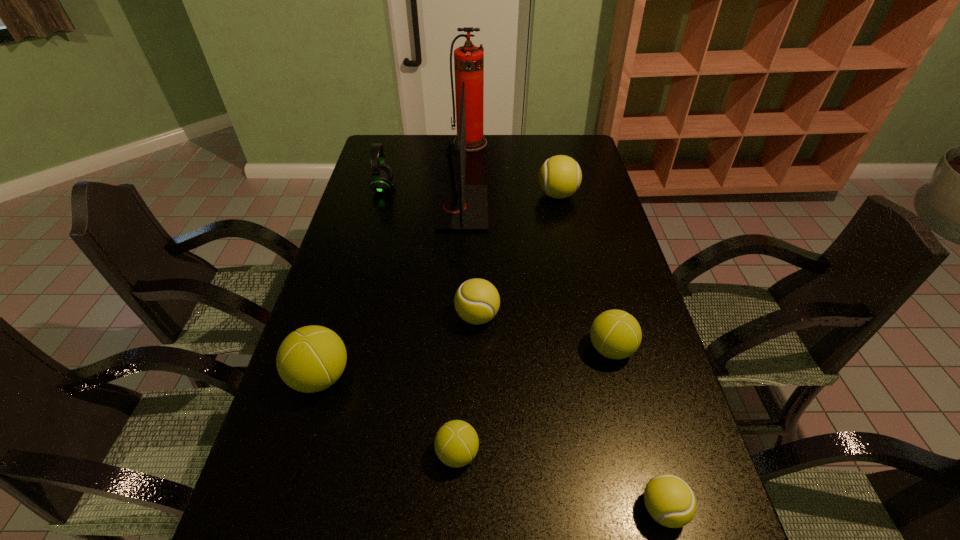
The height and width of the screenshot is (540, 960). I want to click on the leftmost yellow tennis ball, so (477, 301).

This screenshot has height=540, width=960. What are the coordinates of `the second biggest green tennis ball` in the screenshot? It's located at (616, 334).

This screenshot has height=540, width=960. Identify the location of the nearest tennis ball. (670, 501).

Where is `the nearest yellow tennis ball`? the nearest yellow tennis ball is located at coordinates (670, 501).

Find the location of a particular element. The height and width of the screenshot is (540, 960). the second nearest object is located at coordinates (456, 444).

Locate an element on the screen. Image resolution: width=960 pixels, height=540 pixels. the smallest green tennis ball is located at coordinates (456, 444).

Where is `vacant region located at the discharge end of the farthest object`? The image size is (960, 540). vacant region located at the discharge end of the farthest object is located at coordinates (468, 208).

What are the coordinates of `free space located on the screen side of the monitor` in the screenshot? It's located at (568, 208).

I want to click on vacant position located on the ear cups of the black headset, so click(465, 188).

In order to click on free spot located 0.120m on the left of the biggest yellow tennis ball in this screenshot , I will do `click(503, 195)`.